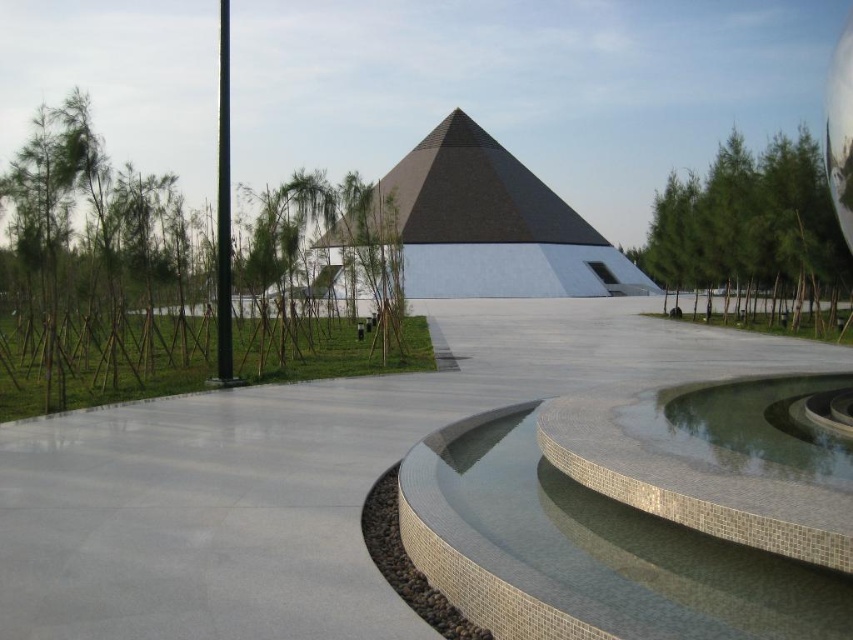
Question: Which point is closer to the camera taking this photo?

Choices:
 (A) (122, 627)
 (B) (814, 627)
 (C) (9, 353)
 (D) (409, 182)

Answer: (B)

Question: Which of these objects is positioned closest to the green leafy tree at upper right?

Choices:
 (A) gray mosaic water at center
 (B) metallic pole at center
 (C) gray polished concrete at center
 (D) green leafy trees at left

Answer: (C)

Question: Which point is farther from the camera taking this photo?

Choices:
 (A) (229, 358)
 (B) (503, 224)

Answer: (B)

Question: Can you confirm if gray polished concrete at center is positioned below gray mosaic water at center?

Choices:
 (A) no
 (B) yes

Answer: (A)

Question: Can you confirm if gray polished concrete at center is bigger than black matte pyramid at center?

Choices:
 (A) no
 (B) yes

Answer: (A)

Question: Does gray mosaic water at center appear on the left side of green leafy tree at upper right?

Choices:
 (A) yes
 (B) no

Answer: (A)